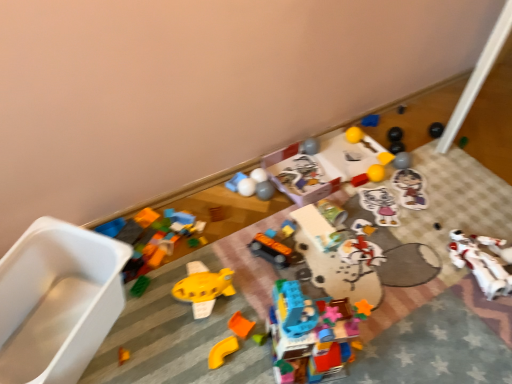
Locate an element on the screen. The height and width of the screenshot is (384, 512). free space to the right of matte white plush cat at center, marked as the fifth toy in a right-to-left arrangement is located at coordinates (424, 212).